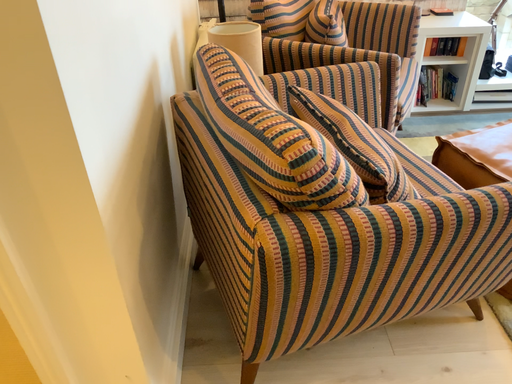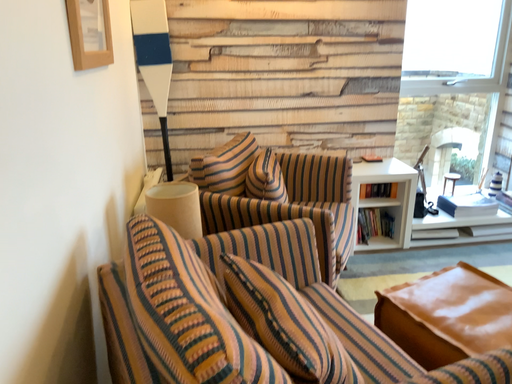
Question: How did the camera likely rotate when shooting the video?

Choices:
 (A) rotated downward
 (B) rotated upward

Answer: (B)